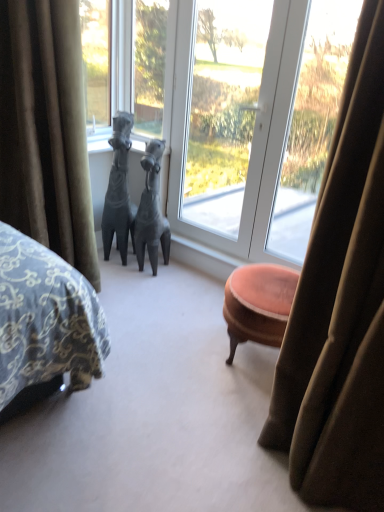
The width and height of the screenshot is (384, 512). I want to click on vacant area that is in front of matte gray horse at center, which is counted as the second animal, starting from the left, so click(x=147, y=283).